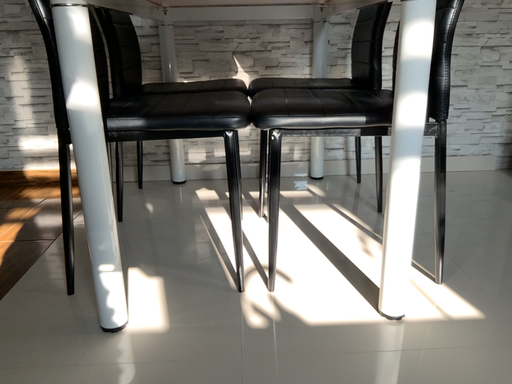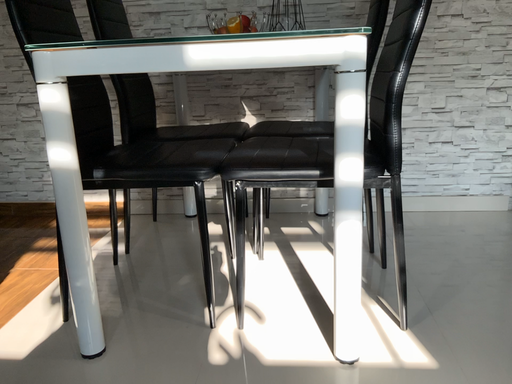
Question: Which way did the camera rotate in the video?

Choices:
 (A) rotated left
 (B) rotated right

Answer: (A)